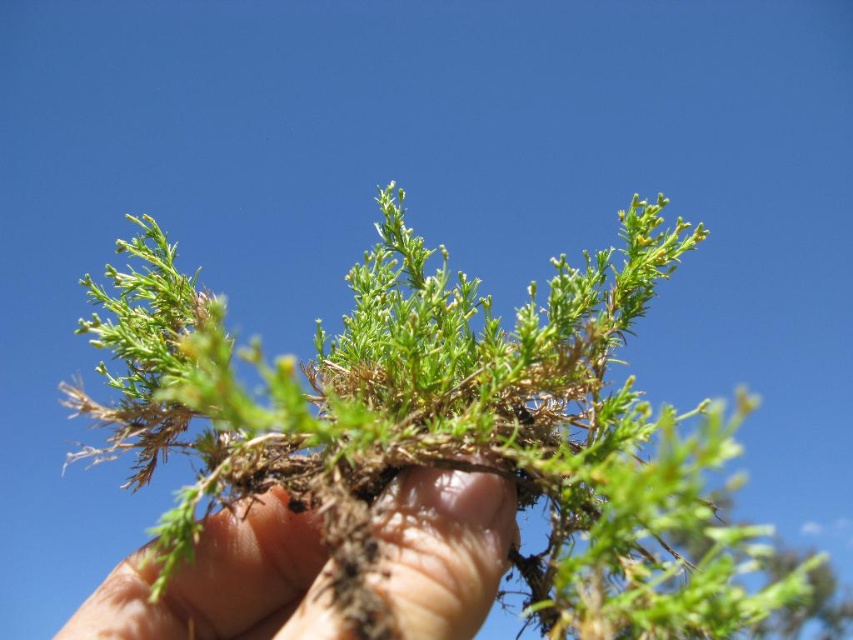
You are a gardener inspecting a plant. You notice the green fibrous plant at center and dry soil at center. Which object is nearer to your face when you look at them?

The green fibrous plant at center is closer to the viewer than dry soil at center, so the green fibrous plant at center is nearer to your face.

You are a gardener trying to determine if the green fibrous plant at center can be replanted into a pot that is the same size as the dry soil at center. Based on their sizes, will the plant fit comfortably in the pot?

The green fibrous plant at center is wider than the dry soil at center, so it may not fit comfortably in a pot of the same size as the dry soil at center.